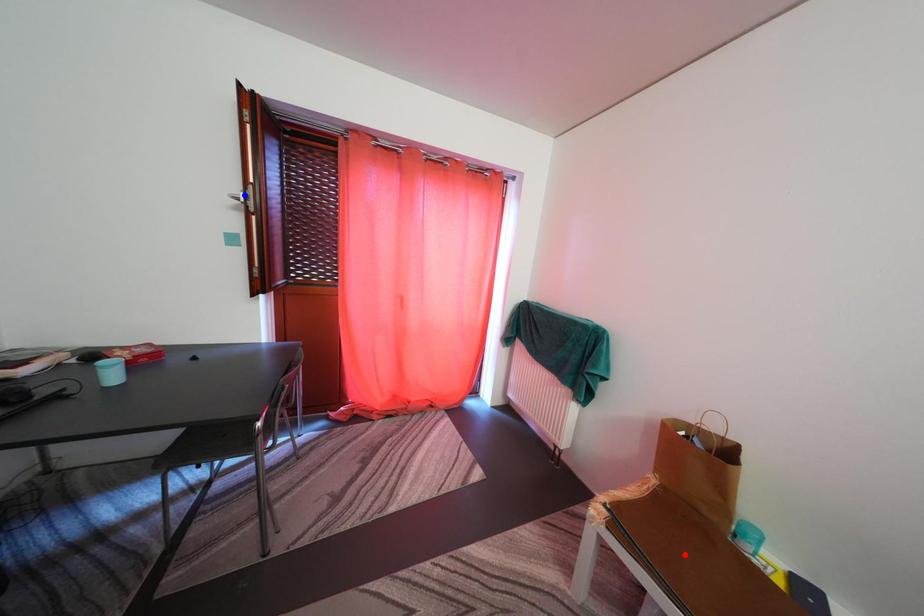
Question: In the image, two points are highlighted. Which point is nearer to the camera? Reply with the corresponding letter.

Choices:
 (A) blue point
 (B) red point

Answer: (B)